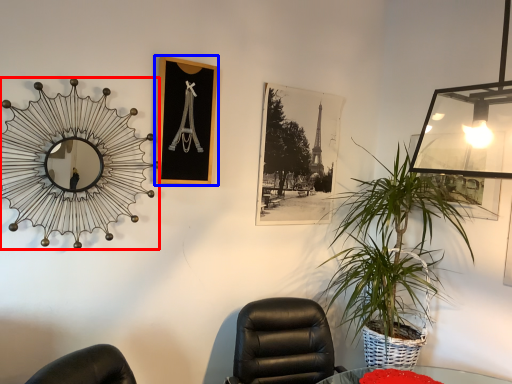
Question: Which point is closer to the camera, mirror (highlighted by a red box) or picture frame (highlighted by a blue box)?

Choices:
 (A) mirror
 (B) picture frame

Answer: (A)